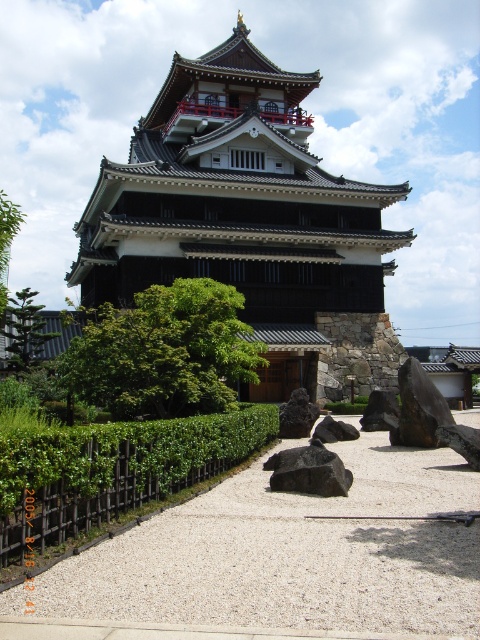
Question: Does green leafy hedge at center come in front of black smooth rock at center?

Choices:
 (A) yes
 (B) no

Answer: (A)

Question: Which of the following is the farthest from the observer?

Choices:
 (A) (210, 84)
 (B) (40, 307)
 (C) (302, 458)

Answer: (A)

Question: Does black wooden pagoda at center come in front of green leafy hedge at center?

Choices:
 (A) no
 (B) yes

Answer: (A)

Question: Which object is positioned farthest from the green leafy hedge at center?

Choices:
 (A) white gravel path at center
 (B) black wooden pagoda at center

Answer: (B)

Question: Does green leafy tree at center come in front of black smooth rock at center?

Choices:
 (A) no
 (B) yes

Answer: (A)

Question: Which point appears farthest from the camera in this image?

Choices:
 (A) (325, 416)
 (B) (194, 449)

Answer: (A)